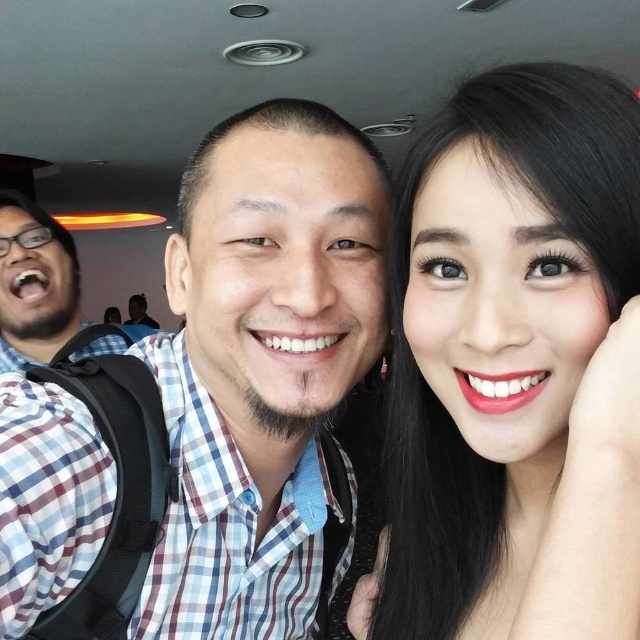
You are a photographer standing in the middle of the room. You want to take a photo of both the blue plaid shirt at center and the matte plaid shirt at left. How far apart are these two shirts?

The blue plaid shirt at center and the matte plaid shirt at left are 4.68 feet apart.

You are a photographer trying to capture a group photo of the smooth skin at upper right and the blue plaid shirt at center. Based on their sizes, which one should you place closer to the camera to make them appear similar in size?

The smooth skin at upper right has a lesser width compared to the blue plaid shirt at center, so to make them appear similar in size, you should place the smooth skin at upper right closer to the camera.